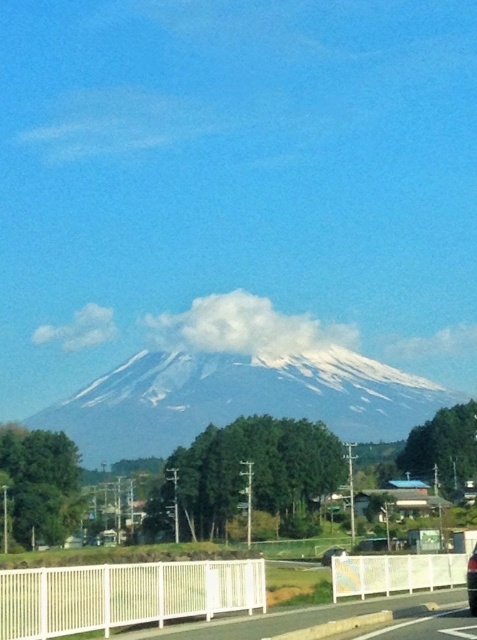
From the picture: You are standing at the base of the mountain and want to take a photo of the two points marked in the image. Which point, point (195,401) or point (474,548), is closer to you?

Point (195,401) is closer to you because it is further to the viewer than point (474,548).